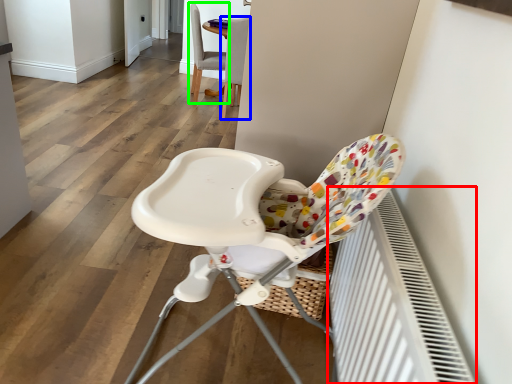
Question: Considering the real-world distances, which object is closest to radiator (highlighted by a red box)? chair (highlighted by a blue box) or chair (highlighted by a green box).

Choices:
 (A) chair
 (B) chair

Answer: (A)